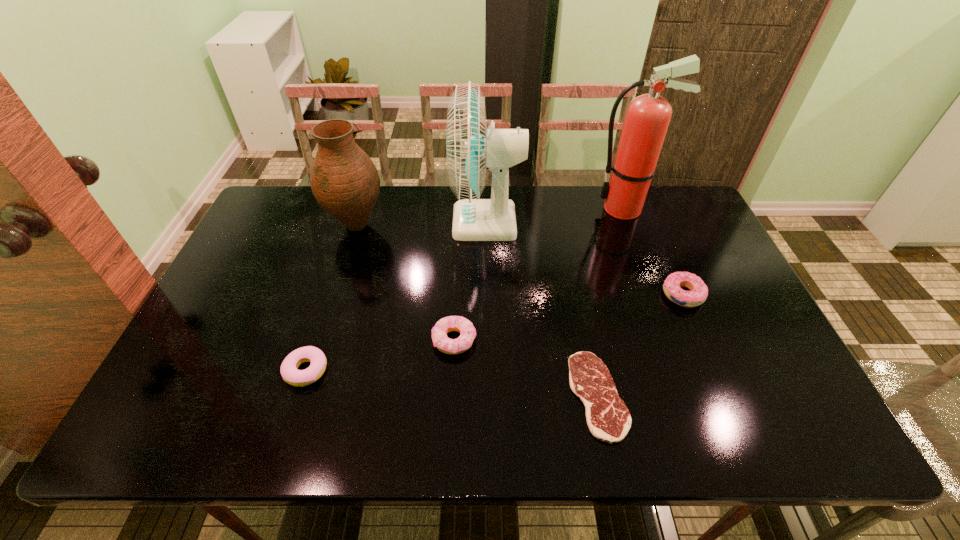
The image size is (960, 540). What are the coordinates of `unoccupied area between the rightmost doughnut and the fire extinguisher` in the screenshot? It's located at (653, 252).

The image size is (960, 540). What are the coordinates of `the second closest object to the fan` in the screenshot? It's located at (647, 118).

This screenshot has height=540, width=960. I want to click on object that is the fourth closest one to the second doughnut from right to left, so click(344, 180).

Image resolution: width=960 pixels, height=540 pixels. Identify the location of doughnut that is the second nearest to the vase. (289, 370).

Image resolution: width=960 pixels, height=540 pixels. Find the location of `doughnut that is the closest to the leftmost doughnut`. doughnut that is the closest to the leftmost doughnut is located at coordinates (467, 331).

Identify the location of free space that satisfies the following two spatial constraints: 1. on the back side of the farthest doughnut; 2. in front of the fan to face the airflow. (652, 222).

Locate an element on the screen. This screenshot has height=540, width=960. free location that satisfies the following two spatial constraints: 1. in front of the fan to face the airflow; 2. on the right side of the fifth object from left to right is located at coordinates (490, 396).

The image size is (960, 540). I want to click on vacant region that satisfies the following two spatial constraints: 1. on the hose direction of the fire extinguisher; 2. on the front side of the leftmost doughnut, so click(684, 370).